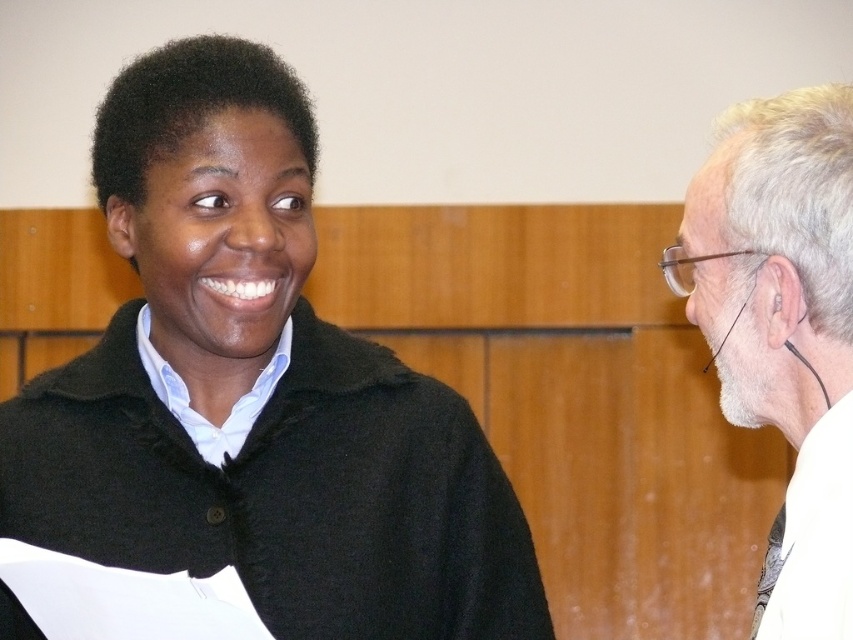
You are an interior designer assessing the proportions of clothing and hair in the scene. Which item, the black wool sweater at upper left or the white hair at right, occupies more vertical space in the image?

The black wool sweater at upper left has a greater height compared to the white hair at right, so it occupies more vertical space.

You are designing a layout for a magazine article about professional attire. You need to place the black wool sweater at upper left and the white hair at right in a way that maintains their relative sizes as shown in the image. Which object should you make wider in your design?

The black wool sweater at upper left should be made wider in the design since it is wider than the white hair at right in the original image.

You are a photographer standing 20 inches away from the black wool sweater at upper left and the white hair at right. Can you fit both objects in your camera frame without moving closer or farther?

The distance between the black wool sweater at upper left and the white hair at right is 19.24 inches, which is less than the 20 inches you are standing away from them. Therefore, you can fit both objects in your camera frame without moving.